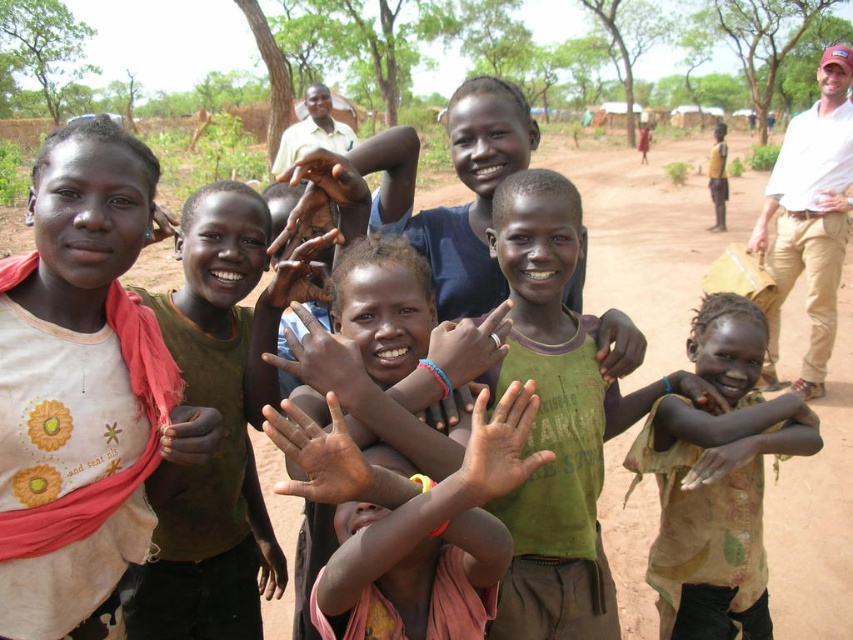
Question: Which of the following is the farthest from the observer?

Choices:
 (A) (480, 368)
 (B) (734, 564)
 (C) (567, 189)
 (D) (102, 292)

Answer: (B)

Question: Does matte white shirt at left appear under matte green hand at center?

Choices:
 (A) no
 (B) yes

Answer: (B)

Question: Can you confirm if green fabric shirt at center is positioned above matte green hand at center?

Choices:
 (A) yes
 (B) no

Answer: (B)

Question: Which point appears farthest from the camera in this image?

Choices:
 (A) (662, 429)
 (B) (134, 608)
 (C) (45, 509)
 (D) (567, 570)

Answer: (A)

Question: Where is green fabric shirt at center located in relation to green cotton shirt at center in the image?

Choices:
 (A) left
 (B) right

Answer: (A)

Question: Which point is farther to the camera?

Choices:
 (A) (119, 160)
 (B) (683, 444)
 (C) (184, 220)
 (D) (482, 368)

Answer: (B)